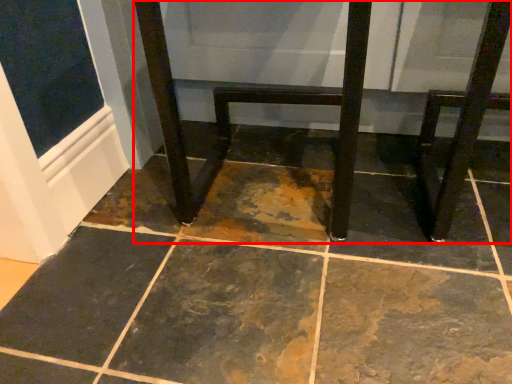
Question: Where is furniture (annotated by the red box) located in relation to step stool in the image?

Choices:
 (A) right
 (B) left

Answer: (B)